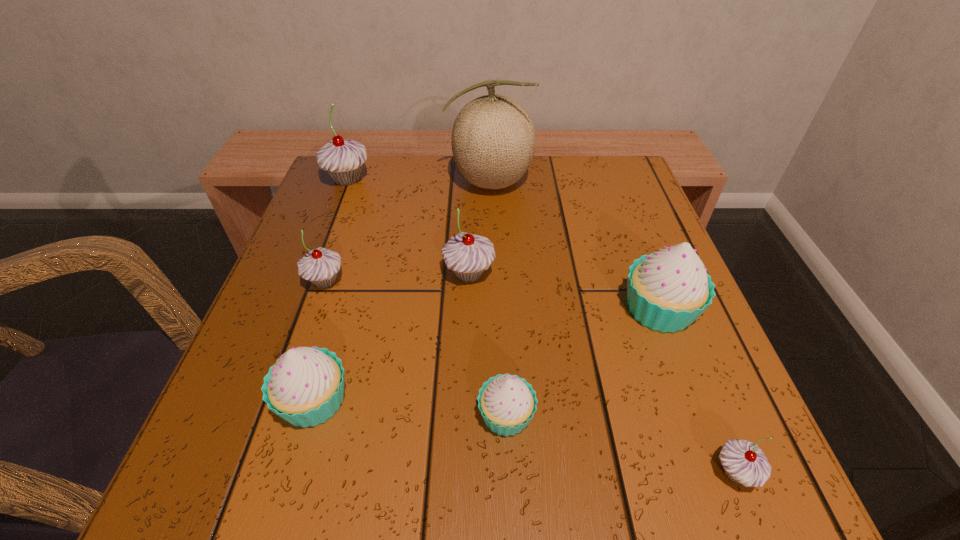
Find the location of a particular element. The height and width of the screenshot is (540, 960). free point that satisfies the following two spatial constraints: 1. on the back side of the second smallest gray cupcake; 2. on the right side of the third smallest gray cupcake is located at coordinates (328, 274).

The height and width of the screenshot is (540, 960). What are the coordinates of `free space that satisfies the following two spatial constraints: 1. on the front side of the second smallest gray cupcake; 2. on the left side of the farthest gray cupcake` in the screenshot? It's located at (308, 281).